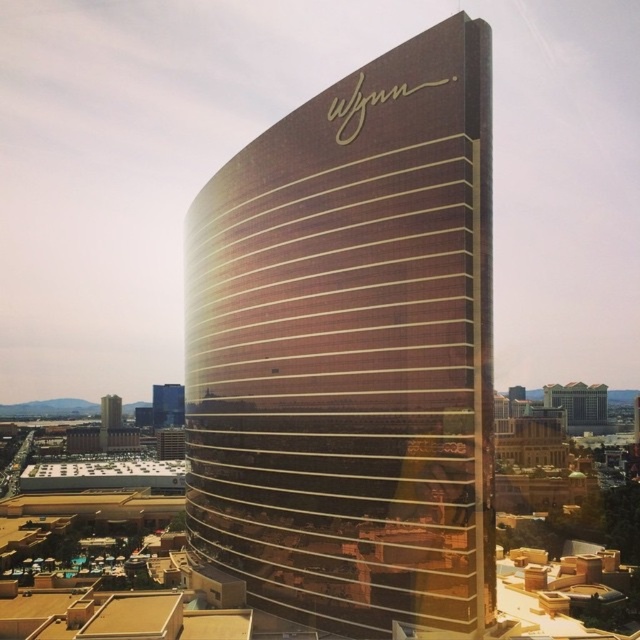
Which is more to the right, gold reflective hotel at center or gold reflective glass tower at lower left?

Positioned to the right is gold reflective hotel at center.

Is gold reflective hotel at center positioned before gold reflective glass tower at lower left?

Yes.

Does point (564, 417) come closer to viewer compared to point (108, 396)?

Yes, it is in front of point (108, 396).

Where is `gold reflective hotel at center`? The height and width of the screenshot is (640, 640). gold reflective hotel at center is located at coordinates (579, 404).

Who is positioned more to the left, shiny glass skyscraper at center or gold reflective glass tower at lower left?

gold reflective glass tower at lower left

Does shiny glass skyscraper at center have a greater height compared to gold reflective glass tower at lower left?

Indeed, shiny glass skyscraper at center has a greater height compared to gold reflective glass tower at lower left.

This screenshot has height=640, width=640. I want to click on shiny glass skyscraper at center, so click(168, 404).

Between gold reflective hotel at center and shiny glass skyscraper at center, which one is positioned higher?

gold reflective hotel at center is above.

From the picture: Which is more to the right, gold reflective hotel at center or shiny glass skyscraper at center?

Positioned to the right is gold reflective hotel at center.

Is point (563, 403) less distant than point (173, 406)?

That is True.

What are the coordinates of `gold reflective hotel at center` in the screenshot? It's located at (579, 404).